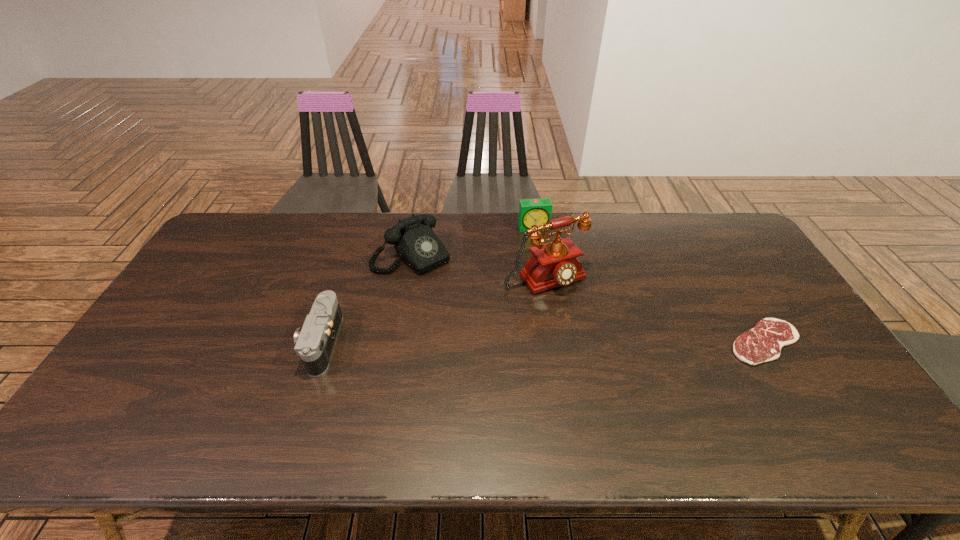
The image size is (960, 540). Find the location of `free point between the left telephone and the farthest object`. free point between the left telephone and the farthest object is located at coordinates (473, 241).

Identify the location of vacant area between the leftmost object and the alarm clock. (428, 285).

Where is `free space between the right telephone and the shortest object`? free space between the right telephone and the shortest object is located at coordinates (655, 310).

Find the location of a particular element. Image resolution: width=960 pixels, height=540 pixels. vacant space that is in between the steak and the camera is located at coordinates (543, 342).

What are the coordinates of `vacant space in between the leftmost object and the right telephone` in the screenshot? It's located at pyautogui.click(x=433, y=310).

Identify the location of vacant area that lies between the left telephone and the alarm clock. (473, 241).

I want to click on free spot between the tallest object and the second object from left to right, so click(x=478, y=267).

I want to click on object that is the fourth closest to the alarm clock, so click(314, 342).

Identify the location of object that stands as the fourth closest to the shorter telephone. This screenshot has width=960, height=540. (x=763, y=343).

In order to click on free location that satisfies the following two spatial constraints: 1. on the back side of the farthest object; 2. on the left side of the fourth object from right to left in this screenshot , I will do `click(417, 227)`.